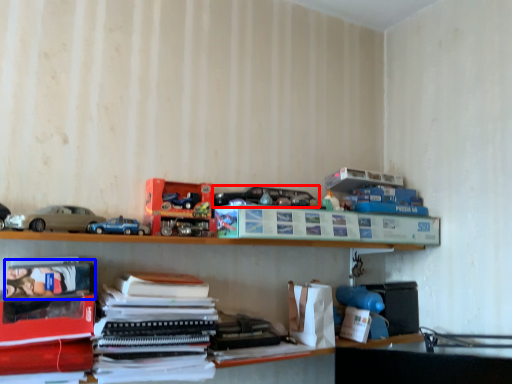
Question: Which object appears farthest to the camera in this image, toy (highlighted by a red box) or book (highlighted by a blue box)?

Choices:
 (A) toy
 (B) book

Answer: (A)